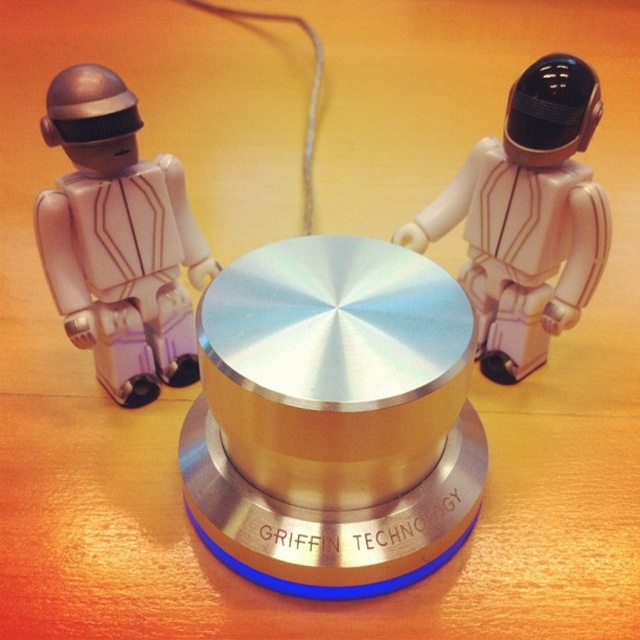
Question: Is satin silver knob at center smaller than white plastic astronaut at center?

Choices:
 (A) no
 (B) yes

Answer: (A)

Question: Can you confirm if matte white robot at left is positioned below white plastic astronaut at center?

Choices:
 (A) no
 (B) yes

Answer: (A)

Question: Can you confirm if matte white robot at left is positioned below white plastic astronaut at center?

Choices:
 (A) yes
 (B) no

Answer: (B)

Question: Considering the real-world distances, which object is closest to the matte white robot at left?

Choices:
 (A) satin silver knob at center
 (B) white plastic astronaut at center

Answer: (A)

Question: Which point is farther to the camera?

Choices:
 (A) white plastic astronaut at center
 (B) matte white robot at left
 (C) satin silver knob at center

Answer: (B)

Question: Which is farther from the matte white robot at left?

Choices:
 (A) white plastic astronaut at center
 (B) satin silver knob at center

Answer: (A)